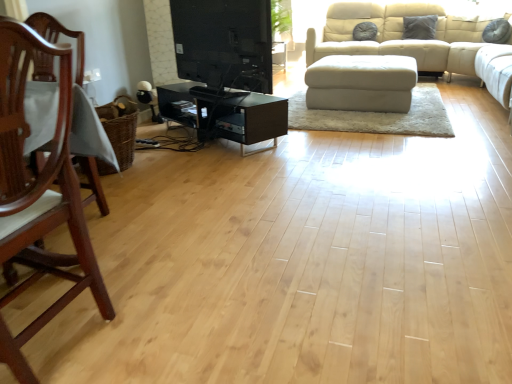
Describe the element at coordinates (228, 115) in the screenshot. I see `black glass tv stand at center` at that location.

Identify the location of mahogany wood chair at left. The width and height of the screenshot is (512, 384). (39, 193).

This screenshot has height=384, width=512. I want to click on black glossy tv stand at center, so click(x=224, y=42).

Is black glossy tv stand at center touching mahogany wood chair at left?

No, black glossy tv stand at center is not beside mahogany wood chair at left.

Is black glossy tv stand at center oriented away from mahogany wood chair at left?

Yes.

Would you say black glossy tv stand at center is outside mahogany wood chair at left?

Yes, black glossy tv stand at center is outside of mahogany wood chair at left.

Which object is further away from the camera taking this photo, black glossy tv stand at center or mahogany wood chair at left?

black glossy tv stand at center.

Between point (337, 58) and point (45, 258), which one is positioned in front?

Point (45, 258)

In terms of width, does white fabric ottoman at center look wider or thinner when compared to mahogany wood chair at left?

Considering their sizes, white fabric ottoman at center looks broader than mahogany wood chair at left.

From the image's perspective, is white fabric ottoman at center beneath mahogany wood chair at left?

No.

Could you tell me if white fabric ottoman at center is facing mahogany wood chair at left?

Yes, white fabric ottoman at center is aimed at mahogany wood chair at left.

Find the location of a particular element. entertainment center in front of the black glass tv stand at center is located at coordinates (224, 42).

Does black glass tv stand at center have a larger size compared to black glossy tv stand at center?

Yes.

Is black glass tv stand at center behind black glossy tv stand at center?

That is True.

Is black glossy tv stand at center in front of or behind white fabric ottoman at center in the image?

In the image, black glossy tv stand at center appears in front of white fabric ottoman at center.

Can you confirm if black glossy tv stand at center is shorter than white fabric ottoman at center?

No, black glossy tv stand at center is not shorter than white fabric ottoman at center.

In the scene shown: From a real-world perspective, is black glossy tv stand at center beneath white fabric ottoman at center?

No, from a real-world perspective, black glossy tv stand at center is not beneath white fabric ottoman at center.

Which of these two, black glass tv stand at center or white fabric ottoman at center, is smaller?

With smaller size is black glass tv stand at center.

From the picture: Which is more to the right, black glass tv stand at center or white fabric ottoman at center?

white fabric ottoman at center is more to the right.

Consider the image. Measure the distance between black glass tv stand at center and white fabric ottoman at center.

They are 4.16 feet apart.

Based on the photo, does black glass tv stand at center have a lesser height compared to white fabric ottoman at center?

Correct, black glass tv stand at center is not as tall as white fabric ottoman at center.

From the picture: Is white fabric ottoman at center taller or shorter than black glass tv stand at center?

white fabric ottoman at center is taller than black glass tv stand at center.

Can you confirm if white fabric ottoman at center is positioned to the left of black glass tv stand at center?

Incorrect, white fabric ottoman at center is not on the left side of black glass tv stand at center.

Is point (359, 98) positioned before point (245, 98)?

No, it is not.

In terms of height, does mahogany wood chair at left look taller or shorter compared to black glossy tv stand at center?

In the image, mahogany wood chair at left appears to be taller than black glossy tv stand at center.

Can you confirm if mahogany wood chair at left is thinner than black glossy tv stand at center?

No, mahogany wood chair at left is not thinner than black glossy tv stand at center.

Who is smaller, mahogany wood chair at left or black glossy tv stand at center?

black glossy tv stand at center is smaller.

Is mahogany wood chair at left looking in the opposite direction of black glossy tv stand at center?

mahogany wood chair at left does not have its back to black glossy tv stand at center.

You are a GUI agent. You are given a task and a screenshot of the screen. Output one action in this format:
    pyautogui.click(x=<x>, y=<y>)
    Task: Click on the chair lying on the left of black glossy tv stand at center
    This screenshot has width=512, height=384.
    Given the screenshot: What is the action you would take?
    pyautogui.click(x=39, y=193)

Locate an element on the screen. Image resolution: width=512 pixels, height=384 pixels. chair located below the white fabric ottoman at center (from the image's perspective) is located at coordinates (39, 193).

Looking at the image, which one is located further to mahogany wood chair at left, white fabric ottoman at center or black glossy tv stand at center?

The object further to mahogany wood chair at left is white fabric ottoman at center.

Considering their positions, is black glossy tv stand at center positioned closer to black glass tv stand at center than mahogany wood chair at left?

The object closer to black glass tv stand at center is black glossy tv stand at center.

Estimate the real-world distances between objects in this image. Which object is closer to white fabric ottoman at center, mahogany wood chair at left or black glossy tv stand at center?

black glossy tv stand at center is closer to white fabric ottoman at center.

Based on their spatial positions, is white fabric ottoman at center or mahogany wood chair at left further from black glass tv stand at center?

mahogany wood chair at left is further to black glass tv stand at center.

From the image, which object appears to be farther from black glossy tv stand at center, black glass tv stand at center or white fabric ottoman at center?

white fabric ottoman at center lies further to black glossy tv stand at center than the other object.

Which object lies further to the anchor point mahogany wood chair at left, black glossy tv stand at center or black glass tv stand at center?

Based on the image, black glossy tv stand at center appears to be further to mahogany wood chair at left.

Considering their positions, is mahogany wood chair at left positioned further to white fabric ottoman at center than black glass tv stand at center?

Among the two, mahogany wood chair at left is located further to white fabric ottoman at center.

Based on the photo, estimate the real-world distances between objects in this image. Which object is further from black glass tv stand at center, white fabric ottoman at center or black glossy tv stand at center?

The object further to black glass tv stand at center is white fabric ottoman at center.

Locate an element on the screen. Image resolution: width=512 pixels, height=384 pixels. entertainment center positioned between mahogany wood chair at left and white fabric ottoman at center from near to far is located at coordinates (224, 42).

This screenshot has height=384, width=512. In order to click on table between black glossy tv stand at center and white fabric ottoman at center in the horizontal direction in this screenshot , I will do `click(228, 115)`.

This screenshot has width=512, height=384. In order to click on table located between mahogany wood chair at left and white fabric ottoman at center in the depth direction in this screenshot , I will do (x=228, y=115).

You are a GUI agent. You are given a task and a screenshot of the screen. Output one action in this format:
    pyautogui.click(x=<x>, y=<y>)
    Task: Click on the entertainment center between mahogany wood chair at left and black glass tv stand at center in the front-back direction
    The height and width of the screenshot is (384, 512).
    Given the screenshot: What is the action you would take?
    pyautogui.click(x=224, y=42)